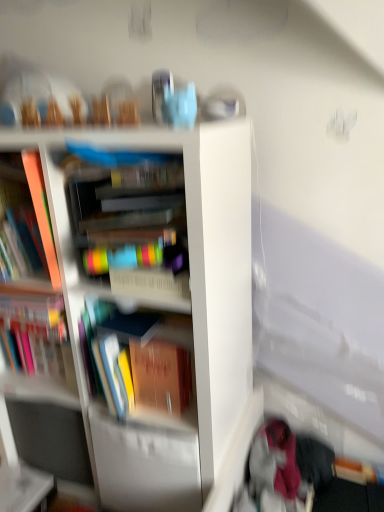
The width and height of the screenshot is (384, 512). Find the location of `multicolored plastic container at center, acting as the 4th book starting from the left`. multicolored plastic container at center, acting as the 4th book starting from the left is located at coordinates (138, 361).

Measure the distance between point (146, 308) and camera.

3.77 feet.

Describe the element at coordinates (41, 212) in the screenshot. I see `matte orange book at left, which is the second book from left to right` at that location.

What is the approximate width of white glossy table at lower left?

white glossy table at lower left is 5.75 inches in width.

This screenshot has width=384, height=512. Find the location of `multicolored plastic container at center, acting as the 4th book starting from the left`. multicolored plastic container at center, acting as the 4th book starting from the left is located at coordinates (138, 361).

From the image's perspective, which is below, white glossy bookcase at center or hardcover book at center, which appears as the third book when viewed from the left?

white glossy bookcase at center is shown below in the image.

Does white glossy bookcase at center have a greater width compared to hardcover book at center, which appears as the third book when viewed from the left?

Indeed, white glossy bookcase at center has a greater width compared to hardcover book at center, which appears as the third book when viewed from the left.

This screenshot has height=512, width=384. In order to click on book in front of the white glossy bookcase at center in this screenshot , I will do `click(134, 226)`.

From the picture: Is white glossy bookcase at center positioned beyond the bounds of hardcover book at center, positioned as the second book in right-to-left order?

Yes, white glossy bookcase at center is located beyond the bounds of hardcover book at center, positioned as the second book in right-to-left order.

In terms of size, does white glossy bookcase at center appear bigger or smaller than velvet pink scarf at lower right?

Considering their sizes, white glossy bookcase at center takes up more space than velvet pink scarf at lower right.

Does white glossy bookcase at center appear on the right side of velvet pink scarf at lower right?

No, white glossy bookcase at center is not to the right of velvet pink scarf at lower right.

In the scene shown: Is velvet pink scarf at lower right at the back of white glossy bookcase at center?

No, white glossy bookcase at center is not facing away from velvet pink scarf at lower right.

In the scene shown: From the image's perspective, is white glossy bookcase at center positioned above or below velvet pink scarf at lower right?

Clearly, from the image's perspective, white glossy bookcase at center is above velvet pink scarf at lower right.

Where is `clothing below the matte orange book at left, which is the second book from left to right (from a real-world perspective)`? The width and height of the screenshot is (384, 512). clothing below the matte orange book at left, which is the second book from left to right (from a real-world perspective) is located at coordinates (287, 461).

Does point (49, 225) appear closer or farther from the camera than point (326, 474)?

Point (49, 225) is closer to the camera than point (326, 474).

Based on the photo, which of these two, matte orange book at left, which is the second book from left to right, or velvet pink scarf at lower right, is wider?

velvet pink scarf at lower right.

Who is shorter, velvet pink scarf at lower right or matte orange book at left, which is the second book from left to right?

velvet pink scarf at lower right.

Is velvet pink scarf at lower right beside matte orange book at left, marked as the 3th book in a right-to-left arrangement?

There is a gap between velvet pink scarf at lower right and matte orange book at left, marked as the 3th book in a right-to-left arrangement.

Considering the positions of objects velvet pink scarf at lower right and matte orange book at left, which is the second book from left to right, in the image provided, who is more to the right, velvet pink scarf at lower right or matte orange book at left, which is the second book from left to right,?

From the viewer's perspective, velvet pink scarf at lower right appears more on the right side.

Considering the relative sizes of hardcover book at center, positioned as the second book in right-to-left order, and velvet pink scarf at lower right in the image provided, is hardcover book at center, positioned as the second book in right-to-left order, taller than velvet pink scarf at lower right?

Yes.

Considering the sizes of objects hardcover book at center, positioned as the second book in right-to-left order, and velvet pink scarf at lower right in the image provided, who is wider, hardcover book at center, positioned as the second book in right-to-left order, or velvet pink scarf at lower right?

hardcover book at center, positioned as the second book in right-to-left order, is wider.

Is hardcover book at center, positioned as the second book in right-to-left order, next to velvet pink scarf at lower right?

No, hardcover book at center, positioned as the second book in right-to-left order, is not touching velvet pink scarf at lower right.

From a real-world perspective, is matte orange book at left, which is the second book from left to right, positioned above or below white glossy table at lower left?

matte orange book at left, which is the second book from left to right, is above white glossy table at lower left.

Is matte orange book at left, which is the second book from left to right, aimed at white glossy table at lower left?

No, matte orange book at left, which is the second book from left to right, is not turned towards white glossy table at lower left.

Considering the positions of point (34, 154) and point (30, 511), is point (34, 154) closer or farther from the camera than point (30, 511)?

Point (34, 154) is positioned closer to the camera compared to point (30, 511).

Is matte orange book at left, which is the second book from left to right, far from white glossy table at lower left?

They are positioned close to each other.

In the image, is white glossy table at lower left on the left side or the right side of velvet pink scarf at lower right?

From the image, it's evident that white glossy table at lower left is to the left of velvet pink scarf at lower right.

Is white glossy table at lower left wider than velvet pink scarf at lower right?

No.

In the scene shown: Is white glossy table at lower left surrounding velvet pink scarf at lower right?

No.

Is white glossy table at lower left far from velvet pink scarf at lower right?

That's not correct — white glossy table at lower left is a little close to velvet pink scarf at lower right.

Locate an element on the screen. This screenshot has width=384, height=512. bookcase below the hardcover book at center, positioned as the second book in right-to-left order (from the image's perspective) is located at coordinates (147, 312).

Find the location of a particular element. Image resolution: width=384 pixels, height=512 pixels. bookcase that appears above the velvet pink scarf at lower right (from the image's perspective) is located at coordinates (147, 312).

Which object lies further to the anchor point matte orange book at left, marked as the 3th book in a right-to-left arrangement, hardcover book at left, the fourth book viewed from the right, or white glossy bookcase at center?

white glossy bookcase at center.

From the image, which object appears to be farther from matte orange book at left, marked as the 3th book in a right-to-left arrangement, white glossy bookcase at center or velvet pink scarf at lower right?

velvet pink scarf at lower right is positioned further to the anchor matte orange book at left, marked as the 3th book in a right-to-left arrangement.

Based on their spatial positions, is multicolored plastic container at center, acting as the 4th book starting from the left, or hardcover book at center, positioned as the second book in right-to-left order, further from velvet pink scarf at lower right?

Based on the image, hardcover book at center, positioned as the second book in right-to-left order, appears to be further to velvet pink scarf at lower right.

Based on their spatial positions, is white glossy table at lower left or matte orange book at left, marked as the 3th book in a right-to-left arrangement, further from hardcover book at center, positioned as the second book in right-to-left order?

Based on the image, white glossy table at lower left appears to be further to hardcover book at center, positioned as the second book in right-to-left order.

Looking at this image, based on their spatial positions, is hardcover book at left, which is the first book in left-to-right order, or multicolored plastic container at center, which is the first book in right-to-left order, closer to velvet pink scarf at lower right?

Among the two, multicolored plastic container at center, which is the first book in right-to-left order, is located nearer to velvet pink scarf at lower right.

From the image, which object appears to be farther from white glossy bookcase at center, velvet pink scarf at lower right or hardcover book at left, the fourth book viewed from the right?

Among the two, velvet pink scarf at lower right is located further to white glossy bookcase at center.

Based on their spatial positions, is hardcover book at center, which appears as the third book when viewed from the left, or hardcover book at left, which is the first book in left-to-right order, closer to white glossy table at lower left?

The object closer to white glossy table at lower left is hardcover book at left, which is the first book in left-to-right order.

Looking at this image, from the image, which object appears to be farther from multicolored plastic container at center, which is the first book in right-to-left order, white glossy table at lower left or matte orange book at left, which is the second book from left to right?

white glossy table at lower left is positioned further to the anchor multicolored plastic container at center, which is the first book in right-to-left order.

This screenshot has height=512, width=384. What are the coordinates of `bookcase between hardcover book at left, which is the first book in left-to-right order, and velvet pink scarf at lower right, in the horizontal direction` in the screenshot? It's located at (147, 312).

What are the coordinates of `book between hardcover book at center, positioned as the second book in right-to-left order, and multicolored plastic container at center, which is the first book in right-to-left order, in the up-down direction` in the screenshot? It's located at (41, 212).

Identify the location of table located between hardcover book at left, which is the first book in left-to-right order, and velvet pink scarf at lower right in the left-right direction. (24, 489).

The height and width of the screenshot is (512, 384). What are the coordinates of `bookcase between white glossy table at lower left and velvet pink scarf at lower right from left to right` in the screenshot? It's located at (147, 312).